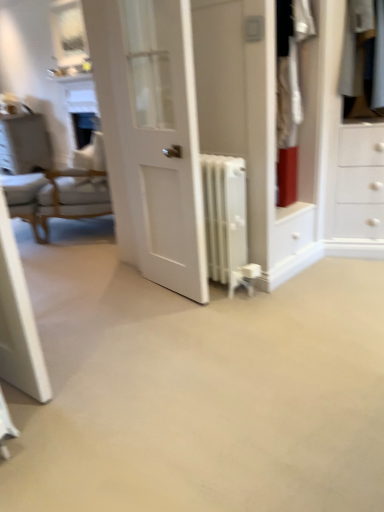
Find the location of a particular element. vacant space underneath white glossy door at center (from a real-world perspective) is located at coordinates (166, 292).